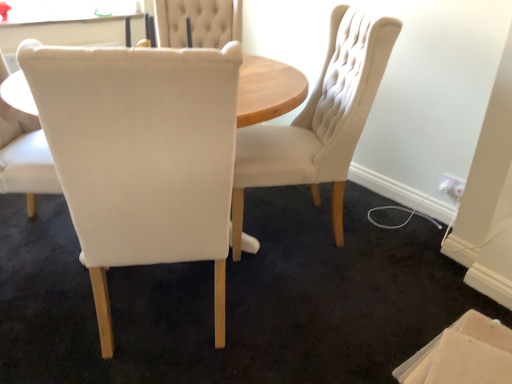
Find the location of `empty space that is to the right of matte cream chair at center, arranged as the first chair when viewed from the right`. empty space that is to the right of matte cream chair at center, arranged as the first chair when viewed from the right is located at coordinates point(389,237).